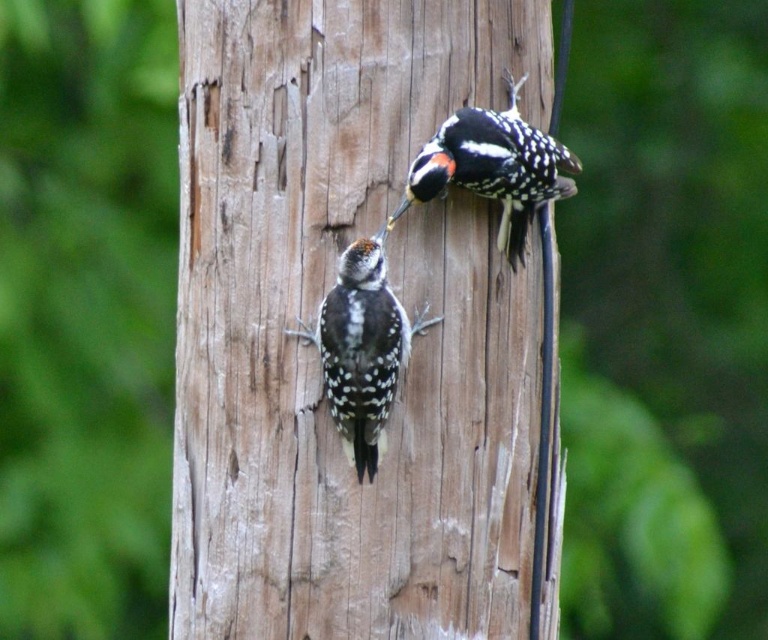
You are a birdwatcher observing two woodpeckers on a pole. You notice the speckled feathered woodpecker at center and the speckled brown woodpecker at upper center. Which of the two woodpeckers is smaller in size?

The speckled feathered woodpecker at center is smaller in size compared to the speckled brown woodpecker at upper center.